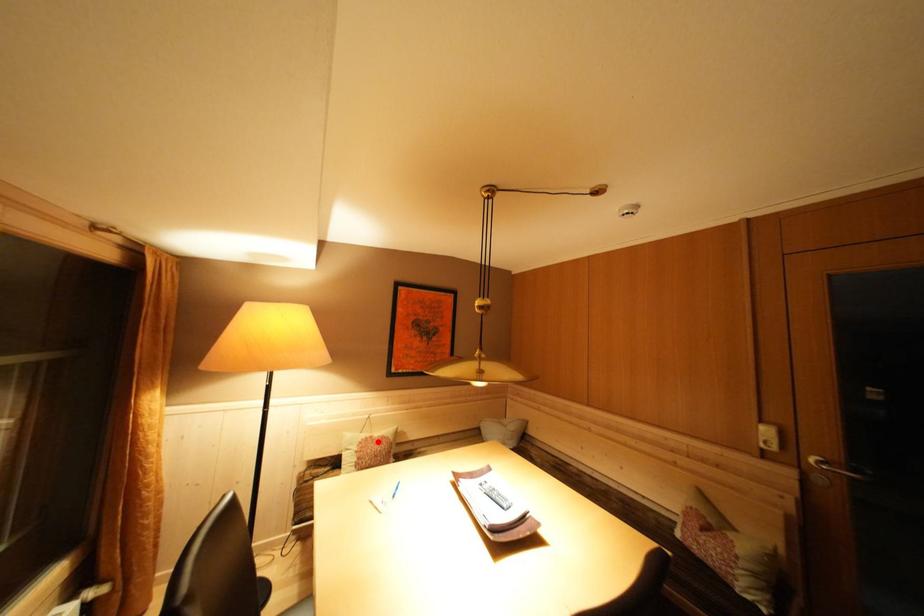
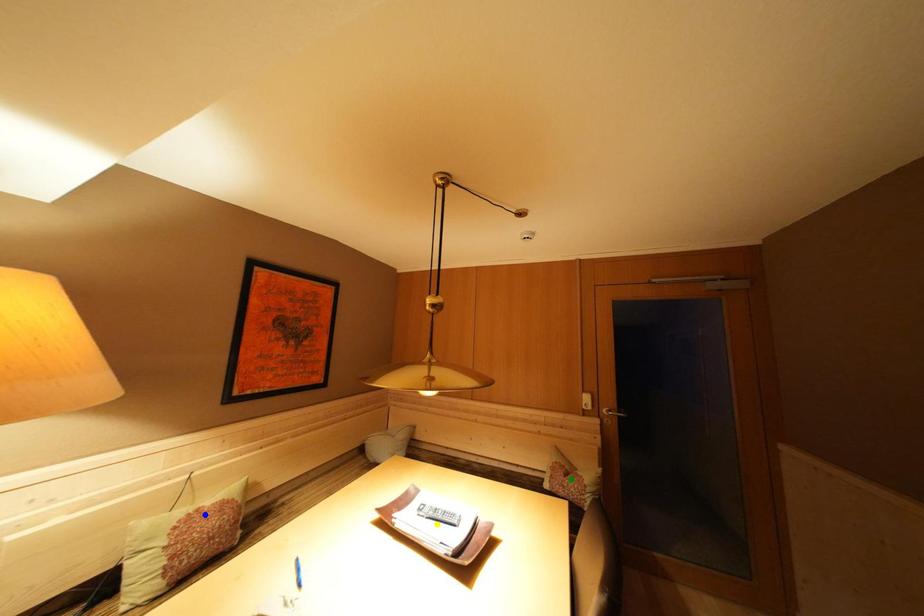
Question: I am providing you with two images of the same scene from different viewpoints. A red point is marked on the first image. You are given multiple points on the second image. Which spot in image 2 lines up with the point in image 1?

Choices:
 (A) yellow point
 (B) blue point
 (C) green point

Answer: (B)